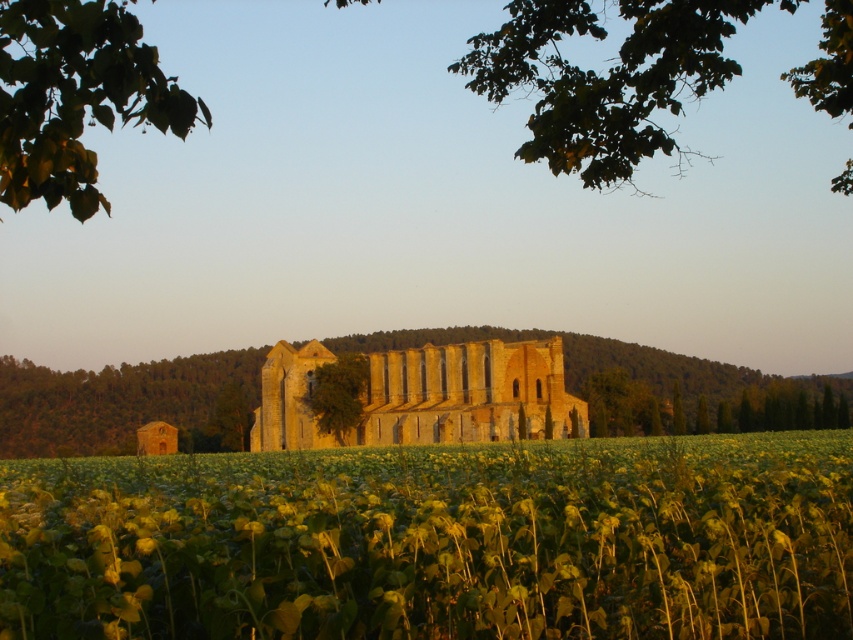
Based on the photo, you are standing in the middle of the sunflower field and see the golden stone ruins at center and the green leafy tree at center. Which object is located to the right of the other?

The golden stone ruins at center is positioned on the right side of green leafy tree at center.

You are an architect examining the golden stone ruins at center and the green leafy tree at center in the image. Which structure is taller?

The golden stone ruins at center is taller than the green leafy tree at center.

You are standing in the field of sunflowers looking at the ancient stone structure. Which object, the green leafy tree at upper right or the green leafy branch at upper left, would block more sunlight if you stand under it?

The green leafy tree at upper right is bigger than the green leafy branch at upper left, so it would block more sunlight if you stand under it.